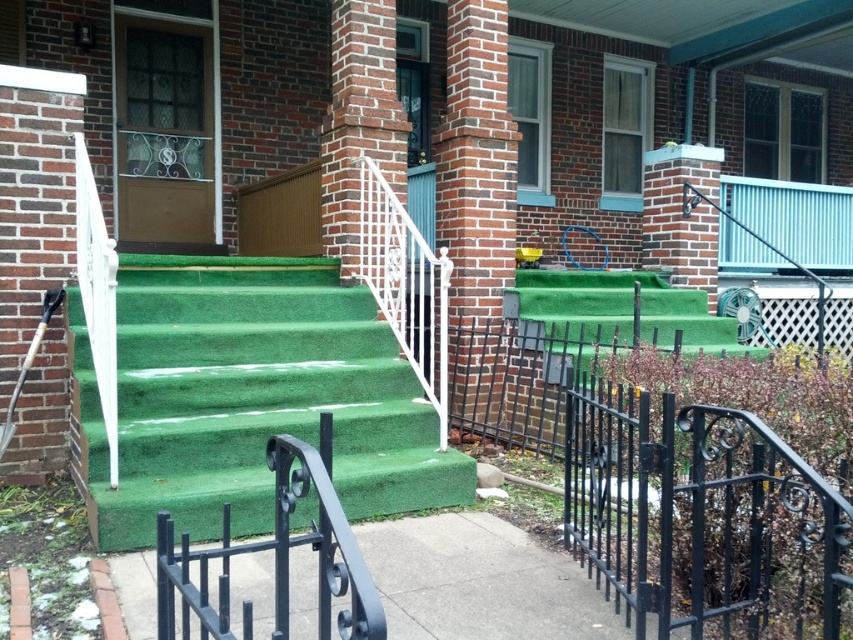
Based on the photo, is green artificial turf at center thinner than black wrought iron at center?

In fact, green artificial turf at center might be wider than black wrought iron at center.

Who is more forward, [222,326] or [328,568]?

Point [328,568] is more forward.

Is point (161, 348) positioned behind point (334, 513)?

Yes, point (161, 348) is farther from viewer.

Locate an element on the screen. The image size is (853, 640). green artificial turf at center is located at coordinates (252, 396).

Does green artificial turf at center have a lesser height compared to black wrought iron railing at lower right?

Incorrect, green artificial turf at center's height does not fall short of black wrought iron railing at lower right's.

Is green artificial turf at center further to the viewer compared to black wrought iron railing at lower right?

Yes, green artificial turf at center is behind black wrought iron railing at lower right.

Identify the location of green artificial turf at center. [x=252, y=396].

Between black wrought iron railing at lower right and black wrought iron at center, which one appears on the right side from the viewer's perspective?

black wrought iron railing at lower right is more to the right.

Is black wrought iron railing at lower right above black wrought iron at center?

No.

Does point (723, 468) come farther from viewer compared to point (163, 595)?

Yes, it is.

The image size is (853, 640). In order to click on black wrought iron railing at lower right in this screenshot , I will do `click(703, 518)`.